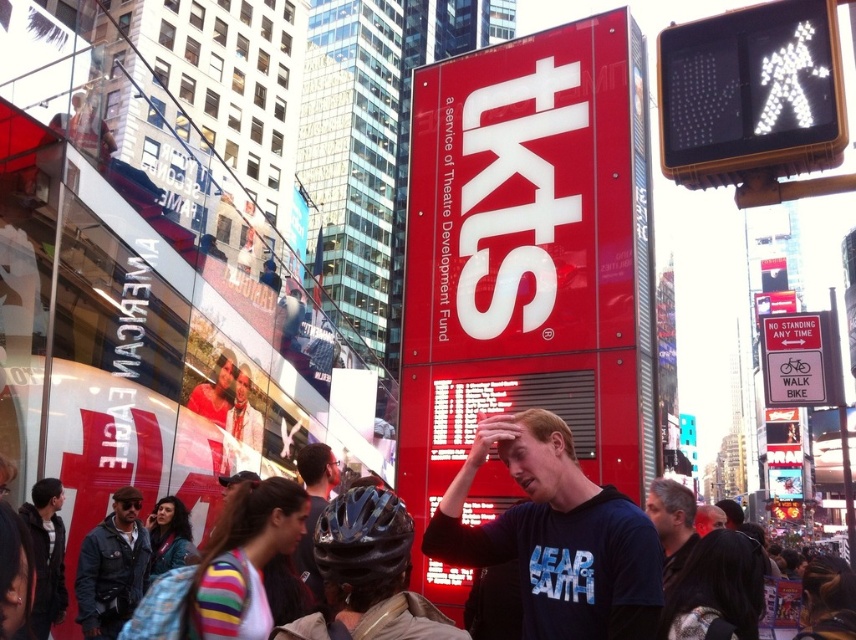
Question: Which point is closer to the camera?

Choices:
 (A) dark blue helmet at center
 (B) dark blue t-shirt at center
 (C) dark brown hair at center

Answer: (B)

Question: Which of these objects is positioned farthest from the dark blue jacket at lower left?

Choices:
 (A) dark blue helmet at center
 (B) dark brown hair at center
 (C) matte black helmet at center
 (D) transparent glass decker bus at center

Answer: (B)

Question: Which point is closer to the camera?

Choices:
 (A) dark brown hair at center
 (B) dark blue helmet at center
 (C) transparent glass decker bus at center
 (D) red matte sign at center

Answer: (D)

Question: Is dark blue jacket at lower left above dark brown hair at center?

Choices:
 (A) yes
 (B) no

Answer: (B)

Question: Is transparent glass decker bus at center further to camera compared to dark blue jacket at lower left?

Choices:
 (A) yes
 (B) no

Answer: (A)

Question: Is transparent glass decker bus at center thinner than matte black helmet at center?

Choices:
 (A) yes
 (B) no

Answer: (B)